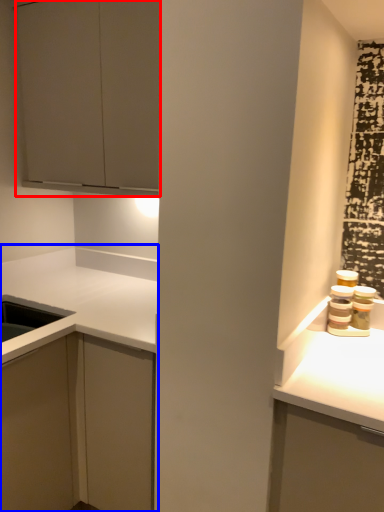
Question: Among these objects, which one is farthest to the camera, cabinetry (highlighted by a red box) or cabinetry (highlighted by a blue box)?

Choices:
 (A) cabinetry
 (B) cabinetry

Answer: (A)